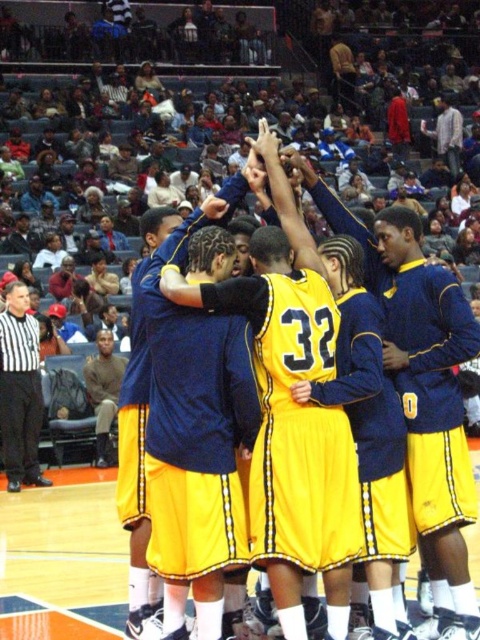
Question: Is yellow matte jersey at center positioned before yellow shiny jersey at center?

Choices:
 (A) yes
 (B) no

Answer: (A)

Question: Which point is closer to the camera?

Choices:
 (A) yellow shiny jersey at center
 (B) white shirt at left

Answer: (A)

Question: Which point appears closest to the camera in this image?

Choices:
 (A) (339, 481)
 (B) (14, 484)
 (C) (299, 358)

Answer: (A)

Question: Is yellow matte jersey at center above white shirt at left?

Choices:
 (A) yes
 (B) no

Answer: (A)

Question: Is yellow matte jersey at center further to the viewer compared to yellow shiny jersey at center?

Choices:
 (A) no
 (B) yes

Answer: (A)

Question: Which of the following is the farthest from the observer?

Choices:
 (A) (309, 364)
 (B) (300, 340)
 (C) (37, 438)

Answer: (C)